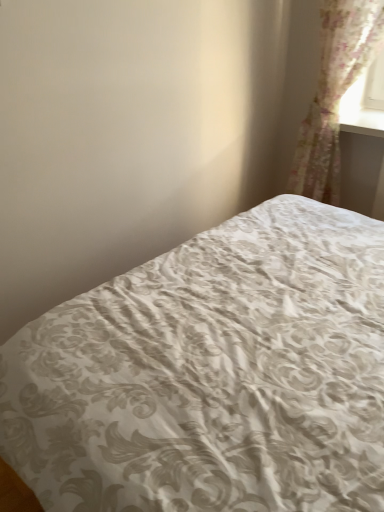
Question: Can you confirm if white damask fabric bed at center is bigger than translucent floral fabric at upper right?

Choices:
 (A) yes
 (B) no

Answer: (A)

Question: Can you confirm if white damask fabric bed at center is smaller than translucent floral fabric at upper right?

Choices:
 (A) yes
 (B) no

Answer: (B)

Question: From the image's perspective, is white damask fabric bed at center beneath translucent floral fabric at upper right?

Choices:
 (A) yes
 (B) no

Answer: (A)

Question: From the image's perspective, does white damask fabric bed at center appear higher than translucent floral fabric at upper right?

Choices:
 (A) no
 (B) yes

Answer: (A)

Question: Is white damask fabric bed at center further to the viewer compared to translucent floral fabric at upper right?

Choices:
 (A) yes
 (B) no

Answer: (B)

Question: Is translucent floral fabric at upper right completely or partially inside white damask fabric bed at center?

Choices:
 (A) yes
 (B) no

Answer: (B)

Question: Is translucent floral fabric at upper right at the left side of white damask fabric bed at center?

Choices:
 (A) yes
 (B) no

Answer: (B)

Question: Can you confirm if translucent floral fabric at upper right is bigger than white damask fabric bed at center?

Choices:
 (A) no
 (B) yes

Answer: (A)

Question: From a real-world perspective, is translucent floral fabric at upper right over white damask fabric bed at center?

Choices:
 (A) yes
 (B) no

Answer: (A)

Question: Considering the relative sizes of translucent floral fabric at upper right and white damask fabric bed at center in the image provided, is translucent floral fabric at upper right smaller than white damask fabric bed at center?

Choices:
 (A) yes
 (B) no

Answer: (A)

Question: Is translucent floral fabric at upper right beside white damask fabric bed at center?

Choices:
 (A) yes
 (B) no

Answer: (B)

Question: Does translucent floral fabric at upper right have a lesser width compared to white damask fabric bed at center?

Choices:
 (A) yes
 (B) no

Answer: (A)

Question: Is white damask fabric bed at center taller or shorter than translucent floral fabric at upper right?

Choices:
 (A) short
 (B) tall

Answer: (A)